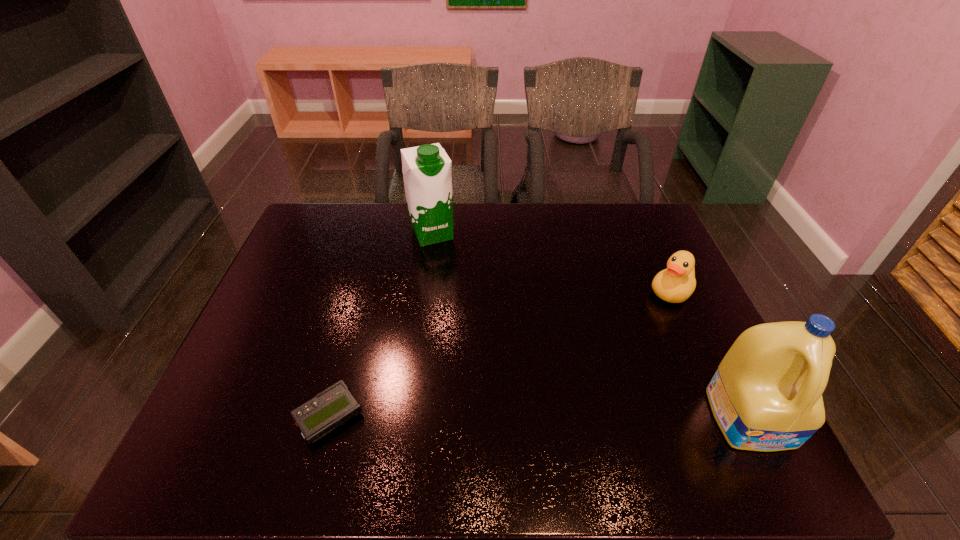
Locate an element on the screen. the shortest object is located at coordinates (334, 406).

Where is `the leftmost object`? This screenshot has width=960, height=540. the leftmost object is located at coordinates (334, 406).

The height and width of the screenshot is (540, 960). I want to click on detergent, so click(766, 395).

Identify the location of the third nearest object. (675, 284).

The width and height of the screenshot is (960, 540). Identify the location of the third tallest object. (675, 284).

I want to click on soya milk, so click(427, 174).

I want to click on the third object from right to left, so click(427, 174).

Image resolution: width=960 pixels, height=540 pixels. In order to click on free space located on the back of the beeper in this screenshot , I will do `click(368, 277)`.

Where is `free location located 0.110m at the beak of the third tallest object`? The height and width of the screenshot is (540, 960). free location located 0.110m at the beak of the third tallest object is located at coordinates (640, 325).

You are a GUI agent. You are given a task and a screenshot of the screen. Output one action in this format:
    pyautogui.click(x=<x>, y=<y>)
    Task: Click on the free space located 0.280m at the beak of the third tallest object
    
    Given the screenshot: What is the action you would take?
    pyautogui.click(x=605, y=363)